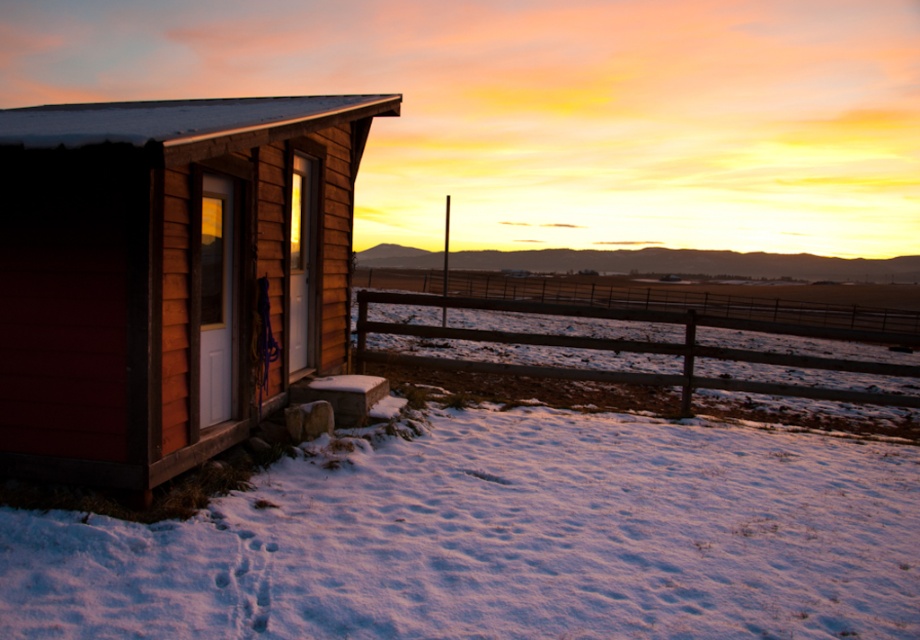
Question: Which point is closer to the camera?

Choices:
 (A) (58, 216)
 (B) (415, 444)

Answer: (A)

Question: Which of the following is the farthest from the observer?

Choices:
 (A) (395, 301)
 (B) (54, 541)

Answer: (A)

Question: From the image, what is the correct spatial relationship of white powdery snow at lower left in relation to brown wooden fence at lower center?

Choices:
 (A) above
 (B) below

Answer: (B)

Question: Which object appears farthest from the camera in this image?

Choices:
 (A) white powdery snow at lower left
 (B) brown wooden fence at lower center

Answer: (B)

Question: Does white powdery snow at lower left lie behind wooden cabin at left?

Choices:
 (A) no
 (B) yes

Answer: (A)

Question: Does white powdery snow at lower left appear on the right side of wooden cabin at left?

Choices:
 (A) no
 (B) yes

Answer: (B)